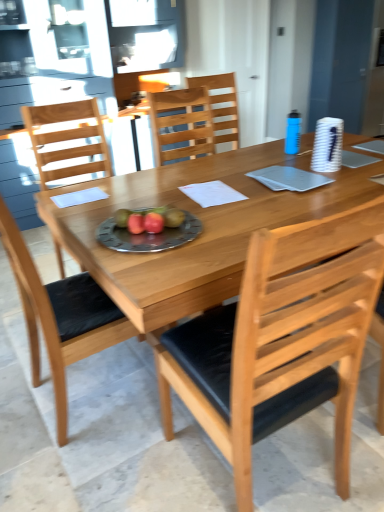
Question: Would you say metallic silver plate with fruits at center is inside or outside natural wood table at center?

Choices:
 (A) outside
 (B) inside

Answer: (B)

Question: Is metallic silver plate with fruits at center in front of or behind natural wood table at center in the image?

Choices:
 (A) behind
 (B) front

Answer: (A)

Question: Which of these objects is positioned farthest from the red matte apple at center, placed as the 1th fruit when sorted from right to left?

Choices:
 (A) wooden chair at center, arranged as the fourth chair when viewed from the front
 (B) natural wood table at center
 (C) light brown wood chair at center, which appears as the 2th chair when viewed from the back
 (D) red matte apple at center, placed as the second fruit when sorted from right to left
 (E) light brown wood chair at left, which appears as the second chair when viewed from the front

Answer: (A)

Question: Which object is the closest to the light brown wood chair at left, acting as the third chair starting from the back?

Choices:
 (A) red matte apple at center, arranged as the first fruit when viewed from the left
 (B) natural wood table at center
 (C) natural wood chair at center, which is the 4th chair from back to front
 (D) light brown wood chair at center, placed as the 3th chair when sorted from front to back
 (E) metallic silver plate with fruits at center

Answer: (E)